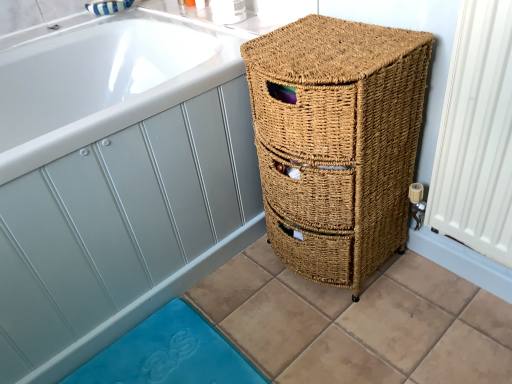
Question: Considering the positions of point (112, 119) and point (327, 205), is point (112, 119) closer or farther from the camera than point (327, 205)?

Choices:
 (A) closer
 (B) farther

Answer: (A)

Question: Looking at the image, does natural woven basket at right seem bigger or smaller compared to natural woven basket at right?

Choices:
 (A) small
 (B) big

Answer: (B)

Question: Considering the real-world distances, which object is farthest from the blue rubber bath mat at lower left?

Choices:
 (A) natural woven basket at right
 (B) natural woven basket at right

Answer: (B)

Question: Estimate the real-world distances between objects in this image. Which object is closer to the natural woven basket at right?

Choices:
 (A) natural woven basket at right
 (B) blue rubber bath mat at lower left

Answer: (A)